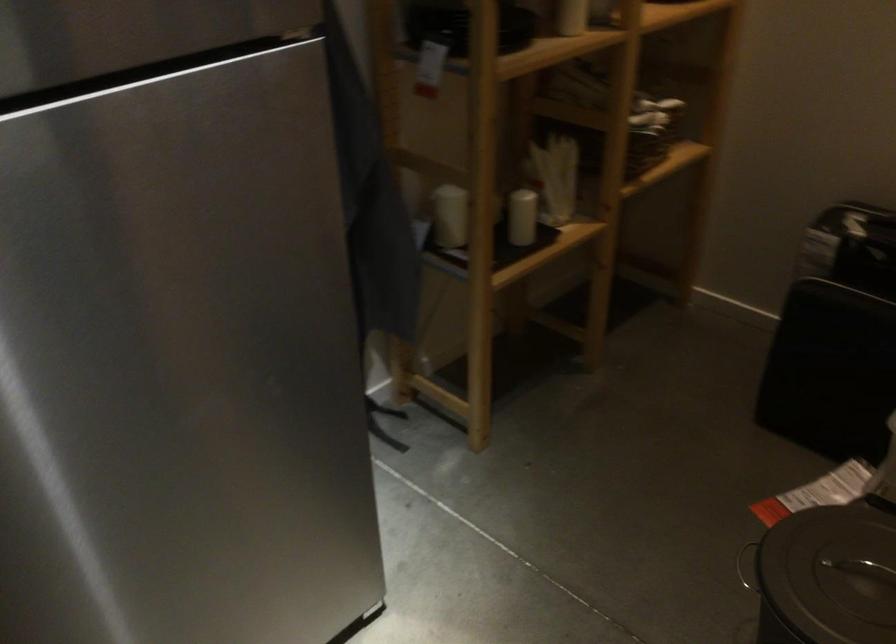
The width and height of the screenshot is (896, 644). I want to click on trash can handle, so click(748, 567).